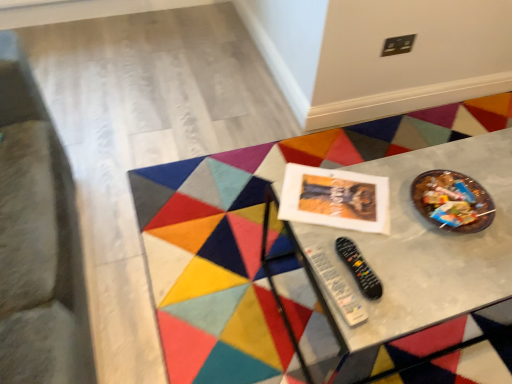
Question: Would you say metallic gray table at center is outside black plastic remote at center, placed as the second control when sorted from left to right?

Choices:
 (A) yes
 (B) no

Answer: (A)

Question: Can you confirm if metallic gray table at center is bigger than black plastic remote at center, the first control when ordered from right to left?

Choices:
 (A) yes
 (B) no

Answer: (A)

Question: Is metallic gray table at center further to the viewer compared to black plastic remote at center, placed as the second control when sorted from left to right?

Choices:
 (A) no
 (B) yes

Answer: (B)

Question: Is metallic gray table at center wider than black plastic remote at center, placed as the second control when sorted from left to right?

Choices:
 (A) yes
 (B) no

Answer: (A)

Question: Is metallic gray table at center far away from black plastic remote at center, the first control when ordered from right to left?

Choices:
 (A) no
 (B) yes

Answer: (A)

Question: Is metallic gray table at center turned away from black plastic remote at center, the first control when ordered from right to left?

Choices:
 (A) yes
 (B) no

Answer: (B)

Question: From the image's perspective, is black plastic remote at lower center, placed as the first control when sorted from left to right, under black plastic remote at center, placed as the second control when sorted from left to right?

Choices:
 (A) no
 (B) yes

Answer: (B)

Question: Considering the relative sizes of black plastic remote at lower center, placed as the first control when sorted from left to right, and black plastic remote at center, placed as the second control when sorted from left to right, in the image provided, is black plastic remote at lower center, placed as the first control when sorted from left to right, taller than black plastic remote at center, placed as the second control when sorted from left to right,?

Choices:
 (A) no
 (B) yes

Answer: (A)

Question: Does black plastic remote at lower center, placed as the first control when sorted from left to right, appear on the right side of black plastic remote at center, placed as the second control when sorted from left to right?

Choices:
 (A) no
 (B) yes

Answer: (A)

Question: Is black plastic remote at lower center, arranged as the 2th control when viewed from the right, facing towards black plastic remote at center, placed as the second control when sorted from left to right?

Choices:
 (A) no
 (B) yes

Answer: (A)

Question: Is the depth of black plastic remote at lower center, placed as the first control when sorted from left to right, greater than that of black plastic remote at center, placed as the second control when sorted from left to right?

Choices:
 (A) no
 (B) yes

Answer: (A)

Question: Can you confirm if black plastic remote at lower center, placed as the first control when sorted from left to right, is positioned to the left of black plastic remote at center, placed as the second control when sorted from left to right?

Choices:
 (A) no
 (B) yes

Answer: (B)

Question: Can you confirm if black plastic remote at center, placed as the second control when sorted from left to right, is taller than black plastic remote at lower center, arranged as the 2th control when viewed from the right?

Choices:
 (A) no
 (B) yes

Answer: (B)